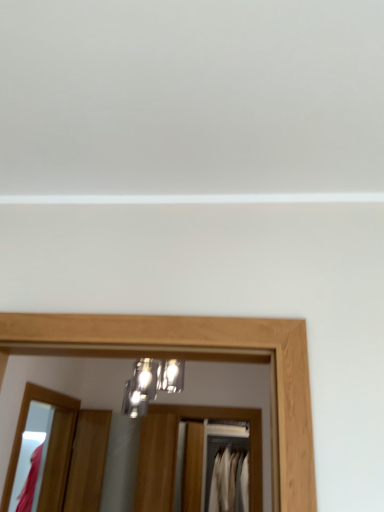
Question: Is white fabric at center, marked as the first clothing in a back-to-front arrangement, positioned behind matte wooden mirror at lower left?

Choices:
 (A) yes
 (B) no

Answer: (A)

Question: Is matte wooden mirror at lower left a part of white fabric at center, which ranks as the 1th clothing in right-to-left order?

Choices:
 (A) yes
 (B) no

Answer: (B)

Question: Is white fabric at center, which ranks as the 1th clothing in right-to-left order, not near matte wooden mirror at lower left?

Choices:
 (A) yes
 (B) no

Answer: (A)

Question: From the image's perspective, would you say white fabric at center, marked as the first clothing in a back-to-front arrangement, is shown under matte wooden mirror at lower left?

Choices:
 (A) yes
 (B) no

Answer: (A)

Question: Is white fabric at center, marked as the 2th clothing in a left-to-right arrangement, shorter than matte wooden mirror at lower left?

Choices:
 (A) yes
 (B) no

Answer: (A)

Question: Does white fabric at center, acting as the second clothing starting from the front, have a lesser width compared to matte wooden mirror at lower left?

Choices:
 (A) no
 (B) yes

Answer: (A)

Question: Is metallic glass light fixture at center far away from matte pink fabric at left, the first clothing from the left?

Choices:
 (A) yes
 (B) no

Answer: (A)

Question: Is metallic glass light fixture at center outside matte pink fabric at left, the first clothing from the left?

Choices:
 (A) yes
 (B) no

Answer: (A)

Question: Can you confirm if metallic glass light fixture at center is smaller than matte pink fabric at left, marked as the 1th clothing in a front-to-back arrangement?

Choices:
 (A) yes
 (B) no

Answer: (A)

Question: Is metallic glass light fixture at center thinner than matte pink fabric at left, the first clothing from the left?

Choices:
 (A) no
 (B) yes

Answer: (A)

Question: Is metallic glass light fixture at center at the left side of matte pink fabric at left, the first clothing from the left?

Choices:
 (A) yes
 (B) no

Answer: (B)

Question: Can you confirm if metallic glass light fixture at center is taller than matte pink fabric at left, the second clothing in the back-to-front sequence?

Choices:
 (A) no
 (B) yes

Answer: (A)

Question: Does matte wooden mirror at lower left have a greater width compared to wooden door at lower left?

Choices:
 (A) no
 (B) yes

Answer: (B)